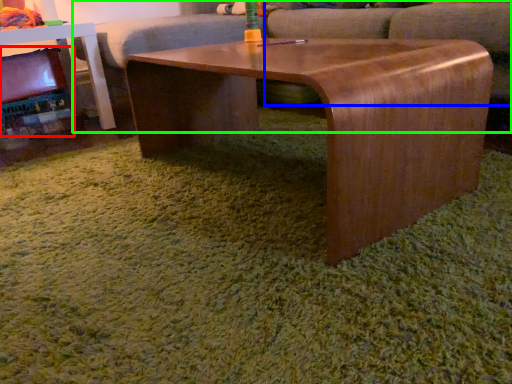
Question: Which is nearer to the fireplace (highlighted by a red box)? swivel chair (highlighted by a blue box) or couch (highlighted by a green box).

Choices:
 (A) swivel chair
 (B) couch

Answer: (B)